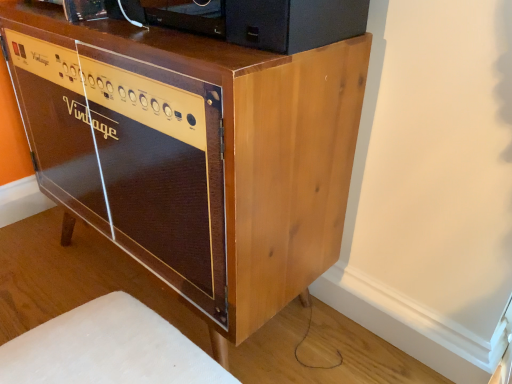
Identify the location of wooden cabinet at center. (198, 136).

The width and height of the screenshot is (512, 384). Describe the element at coordinates (198, 136) in the screenshot. I see `wooden cabinet at center` at that location.

Identify the location of wooden cabinet at center. (198, 136).